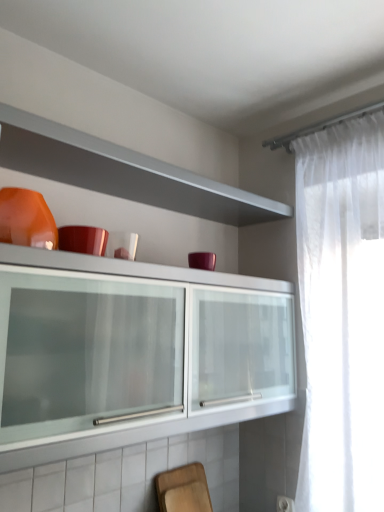
Identify the location of matte orange bowl at upper left. (26, 219).

In order to face matte orange bowl at upper left, should I rotate leftwards or rightwards?

You should look left and rotate roughly 21.476 degrees.

Describe the element at coordinates (26, 219) in the screenshot. This screenshot has width=384, height=512. I see `matte orange bowl at upper left` at that location.

What do you see at coordinates (183, 489) in the screenshot?
I see `wooden cutting board at lower center` at bounding box center [183, 489].

In order to face wooden cutting board at lower center, should I rotate leftwards or rightwards?

Rotate your view right by about 0.560°.

The image size is (384, 512). What are the coordinates of `wooden cutting board at lower center` in the screenshot? It's located at (183, 489).

The image size is (384, 512). I want to click on matte orange bowl at upper left, so click(x=26, y=219).

Which object is positioned more to the right, matte orange bowl at upper left or wooden cutting board at lower center?

wooden cutting board at lower center is more to the right.

Is matte orange bowl at upper left in front of or behind wooden cutting board at lower center in the image?

Visually, matte orange bowl at upper left is located in front of wooden cutting board at lower center.

Considering the positions of point (45, 220) and point (182, 485), is point (45, 220) closer or farther from the camera than point (182, 485)?

Clearly, point (45, 220) is closer to the camera than point (182, 485).

From the image's perspective, which one is positioned higher, matte orange bowl at upper left or wooden cutting board at lower center?

From the image's view, matte orange bowl at upper left is above.

From a real-world perspective, is matte orange bowl at upper left beneath wooden cutting board at lower center?

Incorrect, from a real-world perspective, matte orange bowl at upper left is higher than wooden cutting board at lower center.

Can you confirm if matte orange bowl at upper left is thinner than wooden cutting board at lower center?

No.

Considering the sizes of objects matte orange bowl at upper left and wooden cutting board at lower center in the image provided, who is shorter, matte orange bowl at upper left or wooden cutting board at lower center?

matte orange bowl at upper left is shorter.

Can you confirm if matte orange bowl at upper left is smaller than wooden cutting board at lower center?

Actually, matte orange bowl at upper left might be larger than wooden cutting board at lower center.

Is wooden cutting board at lower center inside matte orange bowl at upper left?

No, wooden cutting board at lower center is not a part of matte orange bowl at upper left.

Is matte orange bowl at upper left far away from wooden cutting board at lower center?

Yes, matte orange bowl at upper left and wooden cutting board at lower center are located far from each other.

Does matte orange bowl at upper left turn towards wooden cutting board at lower center?

No, matte orange bowl at upper left is not oriented towards wooden cutting board at lower center.

Can you tell me how much matte orange bowl at upper left and wooden cutting board at lower center differ in facing direction?

0.331 degrees separate the facing orientations of matte orange bowl at upper left and wooden cutting board at lower center.

What are the coordinates of `tableware above the wooden cutting board at lower center (from a real-world perspective)` in the screenshot? It's located at (26, 219).

Based on their positions, is wooden cutting board at lower center located to the left or right of matte orange bowl at upper left?

Clearly, wooden cutting board at lower center is on the right of matte orange bowl at upper left in the image.

Considering their positions, is wooden cutting board at lower center located in front of or behind matte orange bowl at upper left?

Clearly, wooden cutting board at lower center is behind matte orange bowl at upper left.

Is point (172, 501) positioned in front of point (19, 197)?

No, (172, 501) is behind (19, 197).

From the image's perspective, is wooden cutting board at lower center beneath matte orange bowl at upper left?

Indeed, from the image's perspective, wooden cutting board at lower center is shown beneath matte orange bowl at upper left.

From a real-world perspective, who is located lower, wooden cutting board at lower center or matte orange bowl at upper left?

wooden cutting board at lower center.

Looking at their sizes, would you say wooden cutting board at lower center is wider or thinner than matte orange bowl at upper left?

In the image, wooden cutting board at lower center appears to be more narrow than matte orange bowl at upper left.

Who is taller, wooden cutting board at lower center or matte orange bowl at upper left?

wooden cutting board at lower center.

Does wooden cutting board at lower center have a larger size compared to matte orange bowl at upper left?

Incorrect, wooden cutting board at lower center is not larger than matte orange bowl at upper left.

Is wooden cutting board at lower center completely or partially outside of matte orange bowl at upper left?

Yes, wooden cutting board at lower center is not within matte orange bowl at upper left.

Is wooden cutting board at lower center with matte orange bowl at upper left?

No, wooden cutting board at lower center is not making contact with matte orange bowl at upper left.

Is wooden cutting board at lower center facing towards matte orange bowl at upper left?

No, wooden cutting board at lower center is not oriented towards matte orange bowl at upper left.

What's the angular difference between wooden cutting board at lower center and matte orange bowl at upper left's facing directions?

0.331 degrees separate the facing orientations of wooden cutting board at lower center and matte orange bowl at upper left.

Image resolution: width=384 pixels, height=512 pixels. I want to click on chair to the right of matte orange bowl at upper left, so click(x=183, y=489).

Where is `chair that appears on the right of matte orange bowl at upper left`? This screenshot has height=512, width=384. chair that appears on the right of matte orange bowl at upper left is located at coordinates point(183,489).

Image resolution: width=384 pixels, height=512 pixels. Identify the location of tableware above the wooden cutting board at lower center (from a real-world perspective). (26, 219).